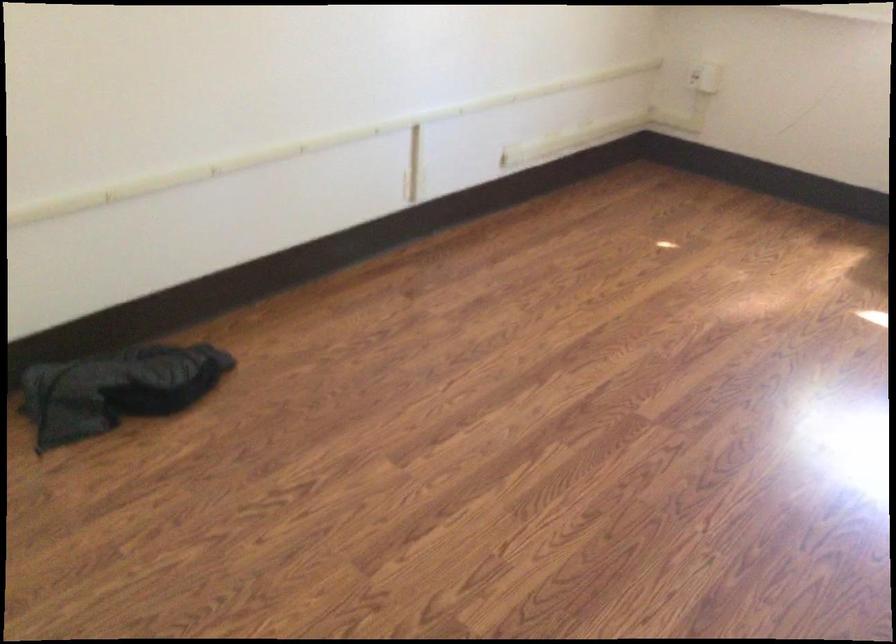
Where would you open the vertical conduit cover? Please return your answer as a coordinate pair (x, y).

(116, 389)